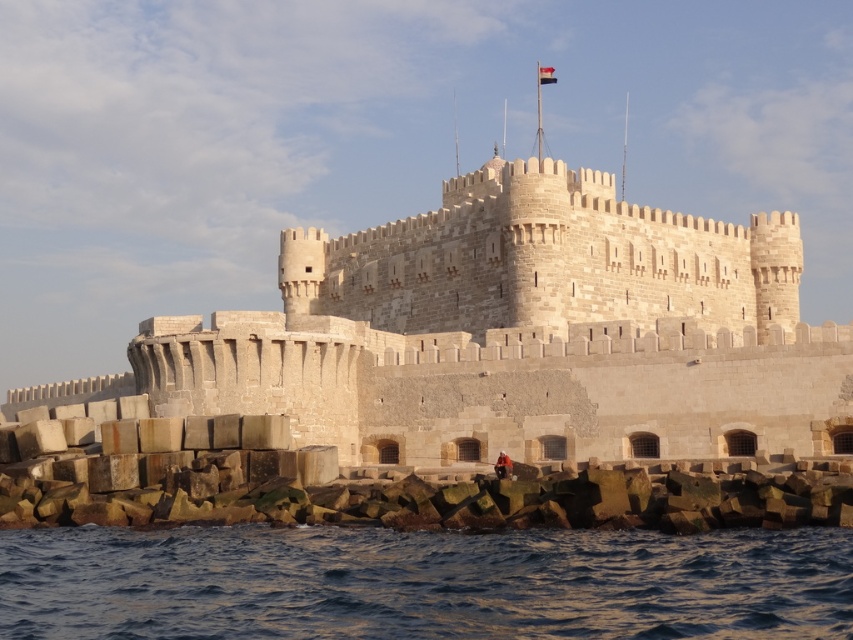
You are a tourist standing on the beach and want to take a photo of the beige stone castle at center and the blue water at lower left. Which object should you focus on first to ensure both are in the frame?

You should focus on the beige stone castle at center first because it is closer to you than the blue water at lower left, so adjusting the camera to include the closer object first ensures the distant blue water at lower left will also be in the frame.

You are a tour guide explaining the fortress to visitors. You mention the beige stone castle at center and the blue water at lower left. Which one is wider?

The beige stone castle at center is wider than the blue water at lower left.

You are a tourist standing at the coordinates 0.4, 0.5 in the image. You want to take a photo of the beige stone castle at center. In which direction should you move to get a better view?

Since the beige stone castle at center is located at point (514, 336), you should move northeast to get closer and have a better view of the beige stone castle at center.